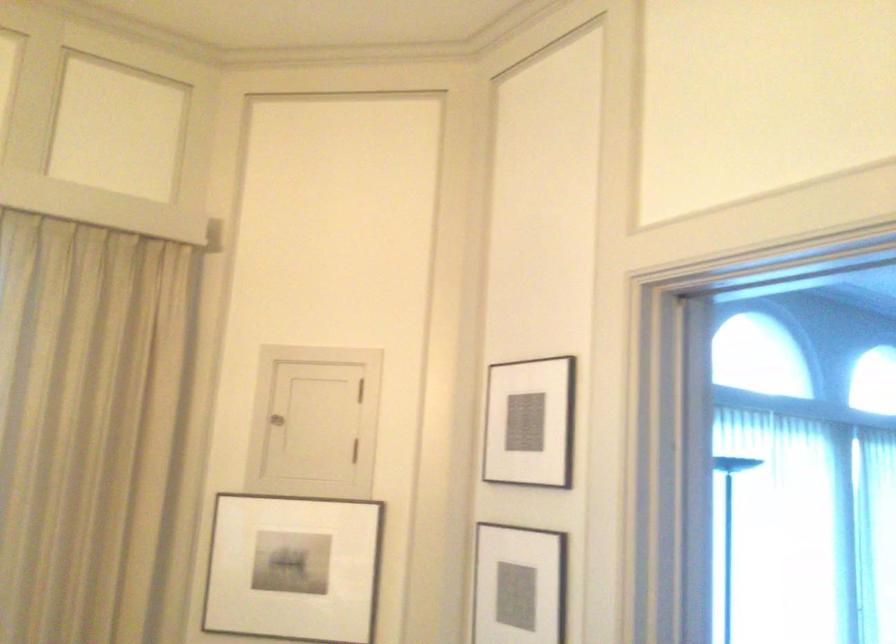
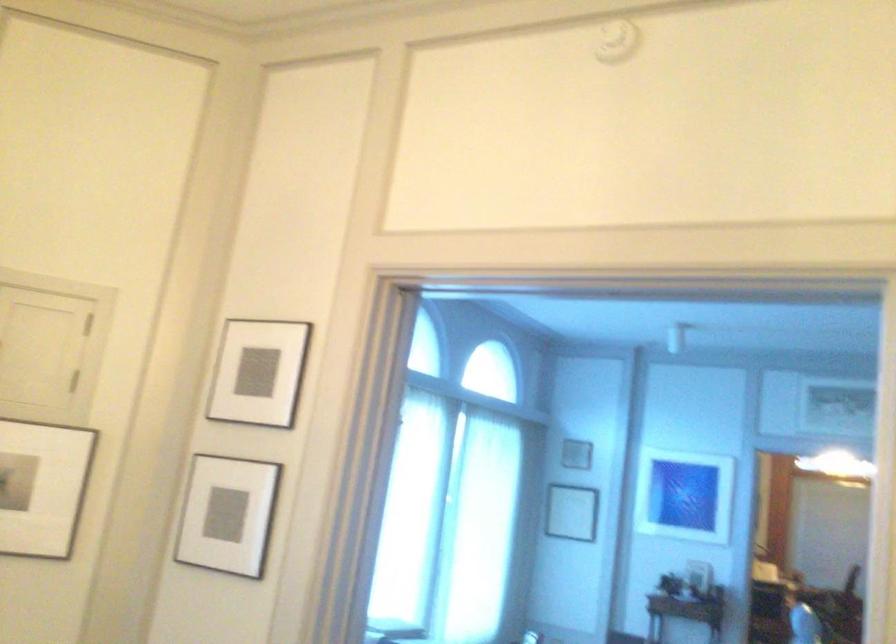
In the second image, find the point that corresponds to the point at 334,420 in the first image.

(49, 346)